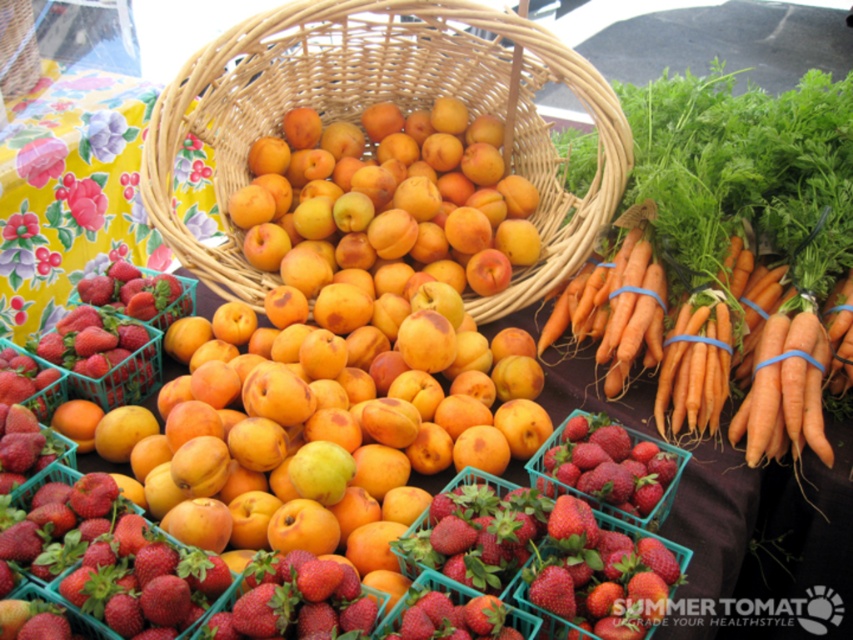
Does yellow matte apricot at center have a lesser height compared to orange smooth carrots at center-right?

No, yellow matte apricot at center is not shorter than orange smooth carrots at center-right.

Based on the photo, does yellow matte apricot at center have a lesser width compared to orange smooth carrots at center-right?

Incorrect, yellow matte apricot at center's width is not less than orange smooth carrots at center-right's.

You are a GUI agent. You are given a task and a screenshot of the screen. Output one action in this format:
    pyautogui.click(x=<x>, y=<y>)
    Task: Click on the yellow matte apricot at center
    The image size is (853, 640).
    Given the screenshot: What is the action you would take?
    pyautogui.click(x=401, y=186)

At what (x,y) coordinates should I click in order to perform the action: click on yellow matte apricot at center. Please return your answer as a coordinate pair (x, y). This screenshot has width=853, height=640. Looking at the image, I should click on (401, 186).

Is yellow matte apricot at center below woven wicker basket at upper center?

Indeed, yellow matte apricot at center is positioned under woven wicker basket at upper center.

Based on the photo, who is higher up, yellow matte apricot at center or woven wicker basket at upper center?

woven wicker basket at upper center is higher up.

Between point (347, 132) and point (26, 22), which one is positioned behind?

The point (26, 22) is more distant.

Where is `yellow matte apricot at center`? yellow matte apricot at center is located at coordinates (401, 186).

Which is above, yellow-orange peaches at center or shiny red strawberries at center?

yellow-orange peaches at center is above.

Based on the photo, can you confirm if yellow-orange peaches at center is thinner than shiny red strawberries at center?

No.

Is point (358, 545) farther from viewer compared to point (561, 444)?

No.

The width and height of the screenshot is (853, 640). I want to click on yellow-orange peaches at center, so click(334, 433).